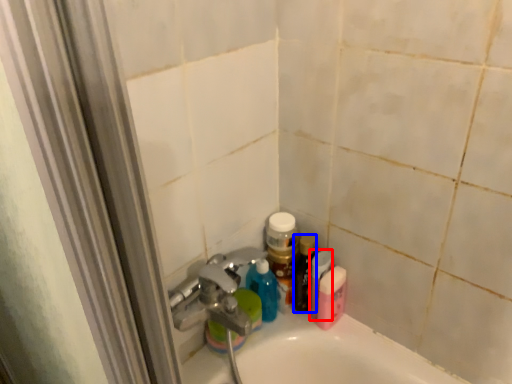
Question: Which of the following is the farthest to the observer, mouthwash (highlighted by a red box) or toiletry (highlighted by a blue box)?

Choices:
 (A) mouthwash
 (B) toiletry

Answer: (B)